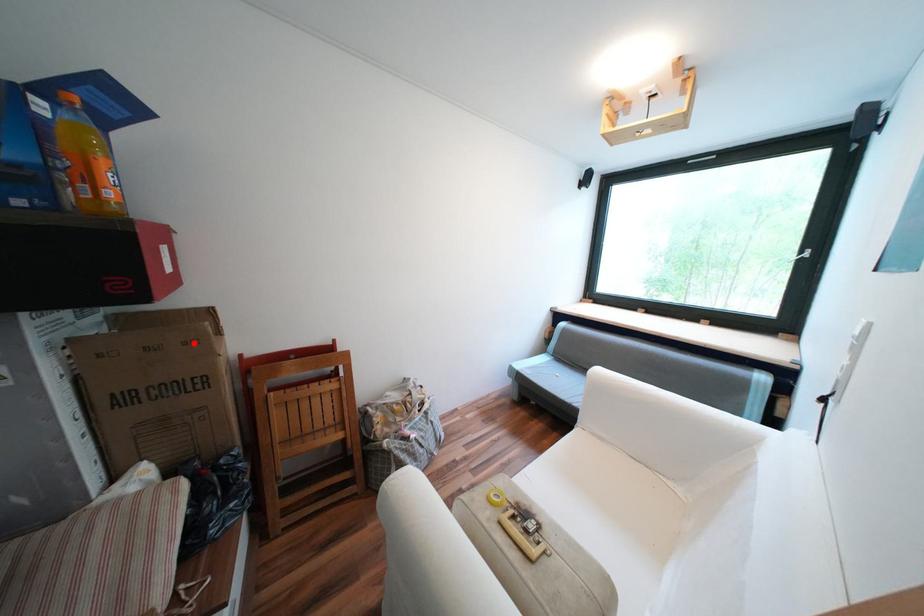
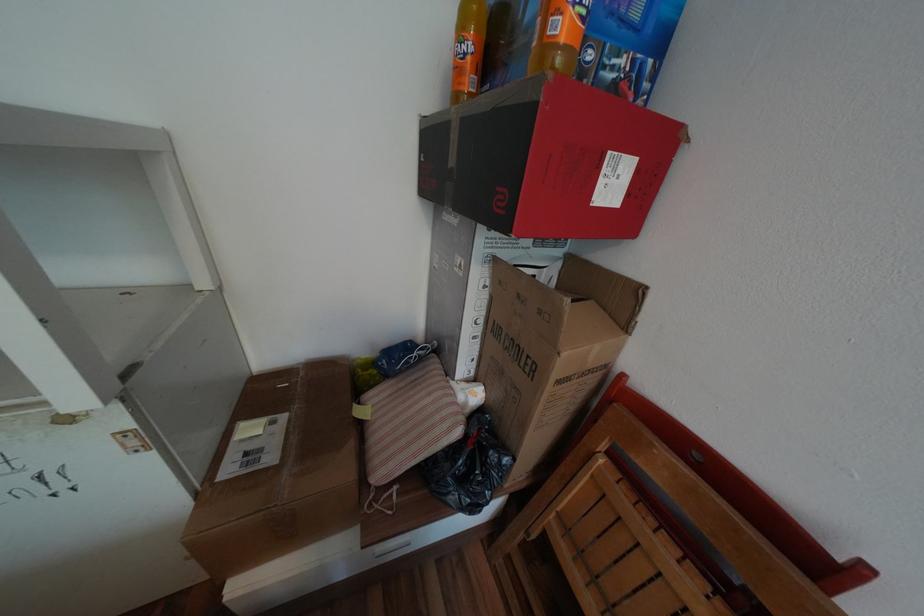
Find the pixel in the second image that matches the highlighted location in the first image.

(550, 312)